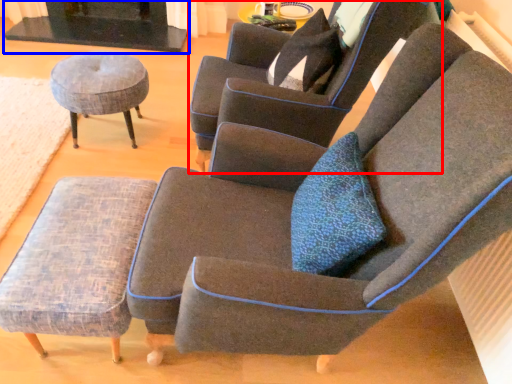
Question: Among these objects, which one is nearest to the camera, chair (highlighted by a red box) or fireplace (highlighted by a blue box)?

Choices:
 (A) chair
 (B) fireplace

Answer: (A)